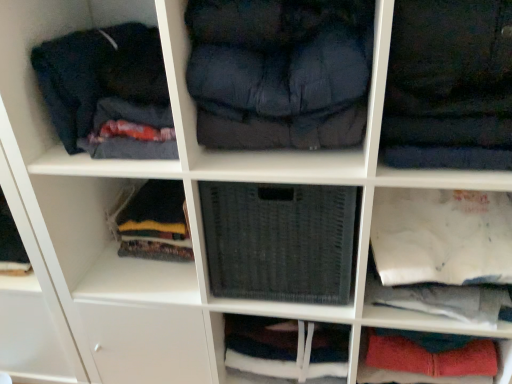
Question: From their relative heights in the image, would you say dark blue fabric at center, the first clothing in the left-to-right sequence, is taller or shorter than dark blue fabric at upper left?

Choices:
 (A) tall
 (B) short

Answer: (A)

Question: From the image's perspective, is dark blue fabric at center, the first clothing in the left-to-right sequence, above or below dark blue fabric at upper left?

Choices:
 (A) below
 (B) above

Answer: (A)

Question: Which of these objects is positioned farthest from the dark blue fabric at center, marked as the second clothing in a right-to-left arrangement?

Choices:
 (A) white paper bag at lower right, the 2th cabinet from the right
 (B) woven fabric basket at center, which is the first cabinet from left to right
 (C) dark blue fabric at upper left
 (D) red fabric pants at lower right, which is the first cabinet from right to left
 (E) woven fabric basket at center, which ranks as the 3th cabinet in right-to-left order

Answer: (D)

Question: Which object is positioned closest to the woven fabric basket at center, which is the first cabinet from left to right?

Choices:
 (A) dark blue fabric at upper left
 (B) dark blue fabric at upper right, placed as the 2th clothing when sorted from left to right
 (C) dark blue fabric at center, the first clothing in the left-to-right sequence
 (D) white paper bag at lower right, placed as the 3th cabinet when sorted from left to right
 (E) red fabric pants at lower right, which is the first cabinet from right to left

Answer: (D)